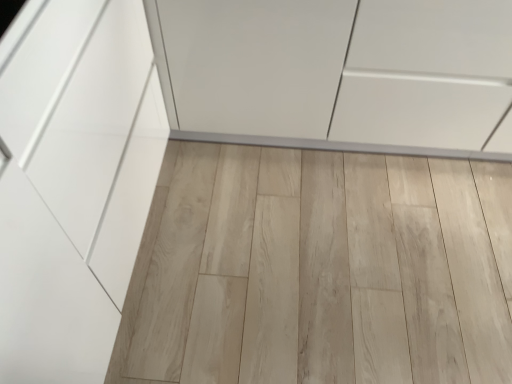
Question: Looking at the image, does natural wood plank at center seem bigger or smaller compared to white glossy cabinet at center?

Choices:
 (A) big
 (B) small

Answer: (B)

Question: Based on their positions, is natural wood plank at center located to the left or right of white glossy cabinet at center?

Choices:
 (A) right
 (B) left

Answer: (B)

Question: In terms of height, does natural wood plank at center look taller or shorter compared to white glossy cabinet at center?

Choices:
 (A) short
 (B) tall

Answer: (A)

Question: Is white glossy cabinet at center taller or shorter than natural wood plank at center?

Choices:
 (A) short
 (B) tall

Answer: (B)

Question: Considering their positions, is white glossy cabinet at center located in front of or behind natural wood plank at center?

Choices:
 (A) front
 (B) behind

Answer: (A)

Question: Is white glossy cabinet at center inside or outside of natural wood plank at center?

Choices:
 (A) inside
 (B) outside

Answer: (B)

Question: From the image's perspective, is white glossy cabinet at center located above or below natural wood plank at center?

Choices:
 (A) above
 (B) below

Answer: (A)